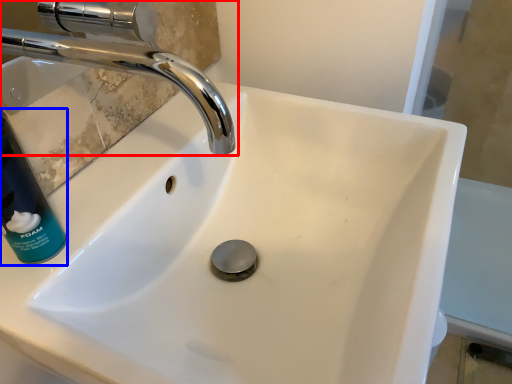
Question: Which point is further to the camera, tap (highlighted by a red box) or cleaning product (highlighted by a blue box)?

Choices:
 (A) tap
 (B) cleaning product

Answer: (B)